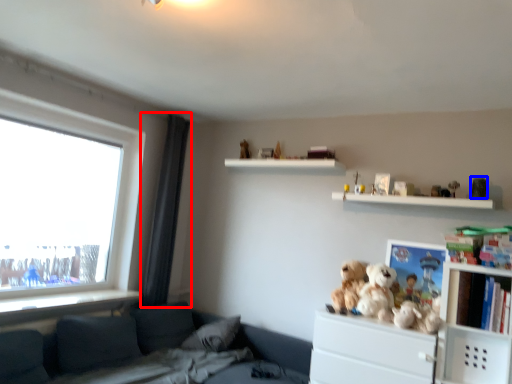
Question: Among these objects, which one is farthest to the camera, curtain (highlighted by a red box) or toy (highlighted by a blue box)?

Choices:
 (A) curtain
 (B) toy

Answer: (A)